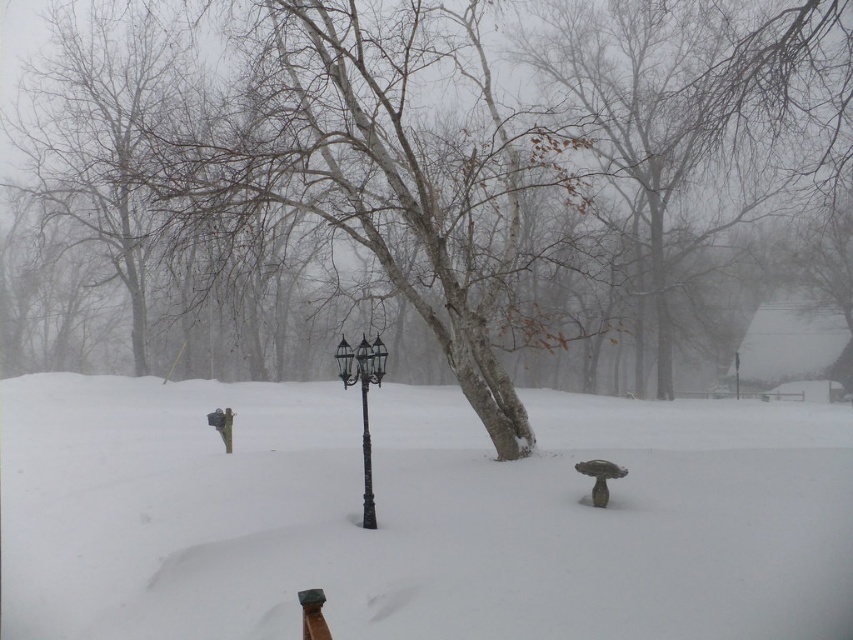
You are standing in the winter scene and want to determine which of the two points, point (x=380, y=342) or point (x=367, y=474), is closer to you. Based on the image description, which point is nearer?

Point (x=380, y=342) is closer to the camera than point (x=367, y=474), so it is the nearer one.